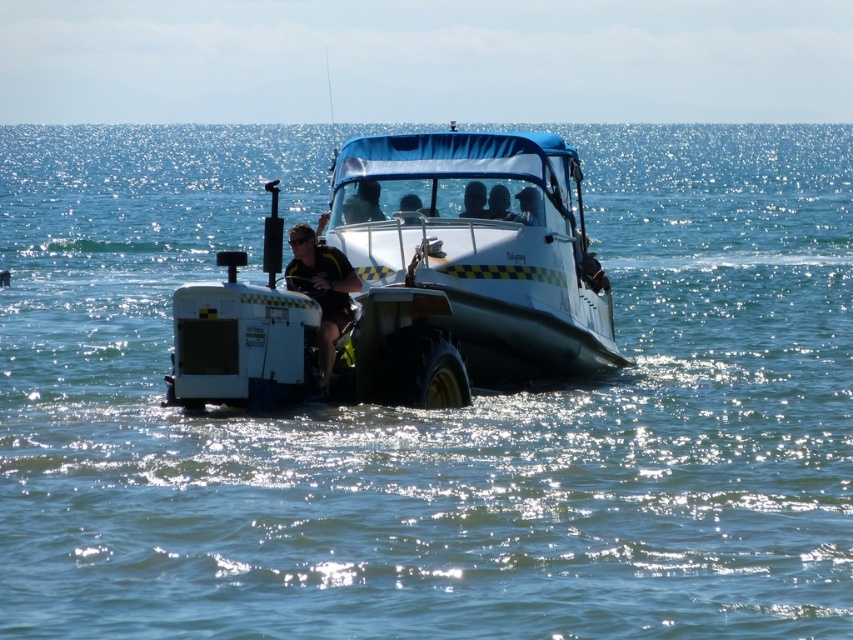
You are a passenger on the white rubber boat at center and want to see the silhouette skin head at center. Which direction should you look?

The white rubber boat at center is below the silhouette skin head at center, so you should look upward to see the silhouette skin head at center.

Where is the white rubber boat at center located in the image?

The white rubber boat at center is located at point (407, 285).